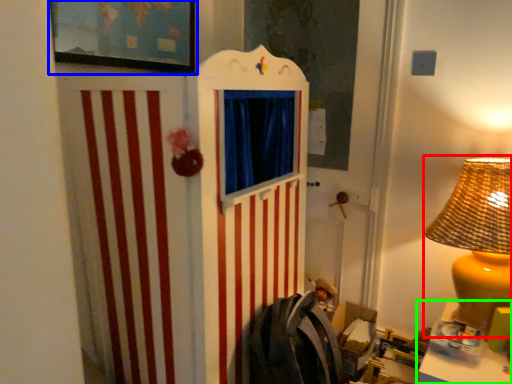
Question: Based on their relative distances, which object is farther from table lamp (highlighted by a red box)? Choose from picture frame (highlighted by a blue box) and table (highlighted by a green box).

Choices:
 (A) picture frame
 (B) table

Answer: (A)